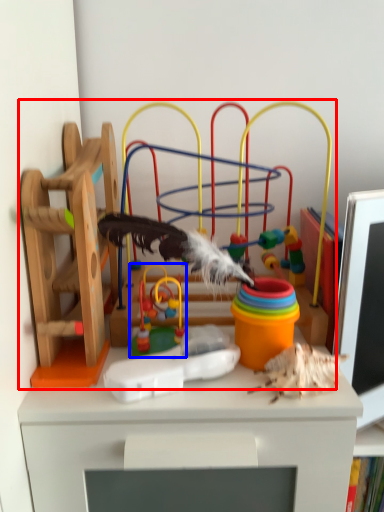
Question: Among these objects, which one is nearest to the camera, toy (highlighted by a red box) or toy (highlighted by a blue box)?

Choices:
 (A) toy
 (B) toy

Answer: (A)